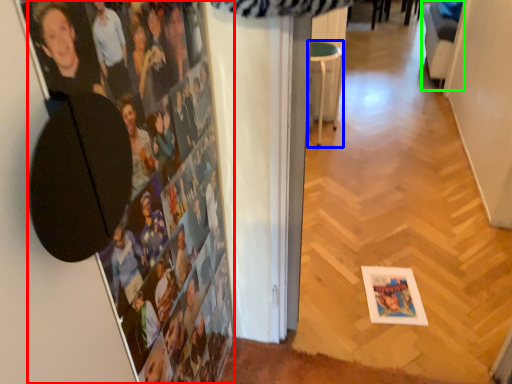
Question: Which is nearer to the person (highlighted by a red box)? furniture (highlighted by a blue box) or swivel chair (highlighted by a green box).

Choices:
 (A) furniture
 (B) swivel chair

Answer: (A)